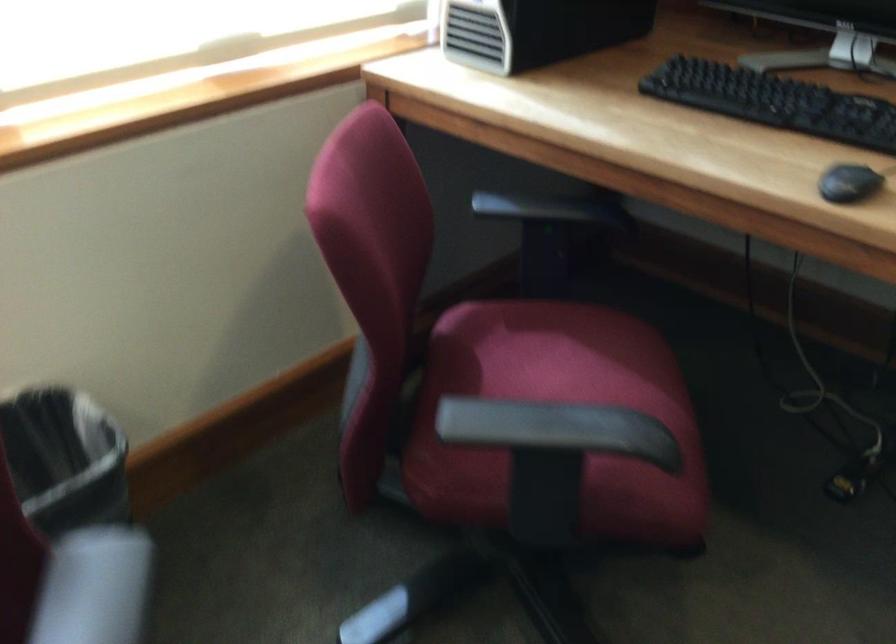
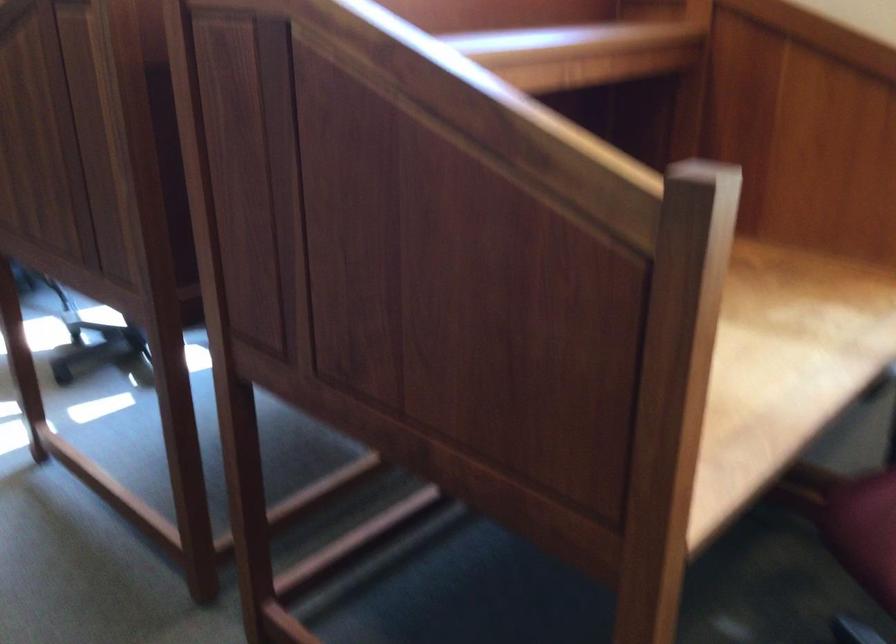
Based on the continuous images, in which direction is the camera rotating?

The camera rotated toward left-down.